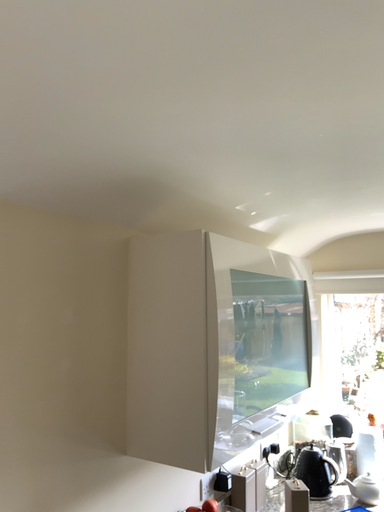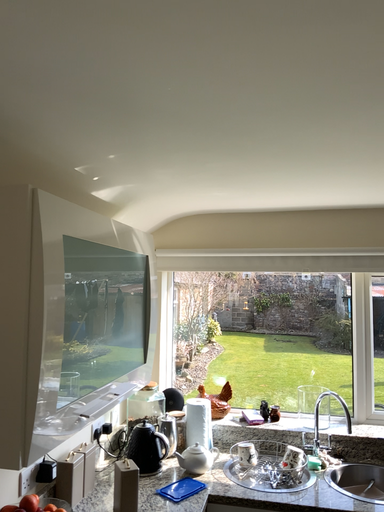
Question: How did the camera likely rotate when shooting the video?

Choices:
 (A) rotated right
 (B) rotated left

Answer: (A)